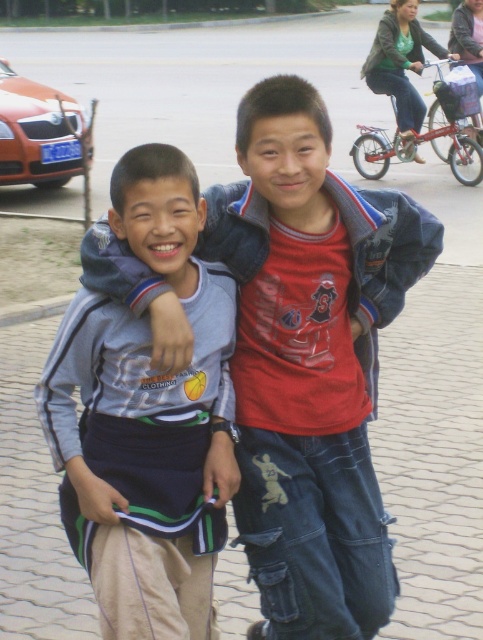
You are standing 2.48 meters away from a specific point in the image. The point is located at coordinates (x=181, y=390). Can you estimate how far the boy on the left is from the point?

The point at (x=181, y=390) is 2.48 meters away from the viewer. The boy on the left is holding onto the jacket of the boy next to him, so they are likely standing close together. Therefore, the distance between the boy on the left and the point is approximately 2.48 meters.

You are a photographer trying to capture a closeup of the gray fabric shirt at left and the denim jacket at upper right. Which object is positioned lower in the image?

The gray fabric shirt at left is located below denim jacket at upper right, so the gray fabric shirt at left is positioned lower in the image.